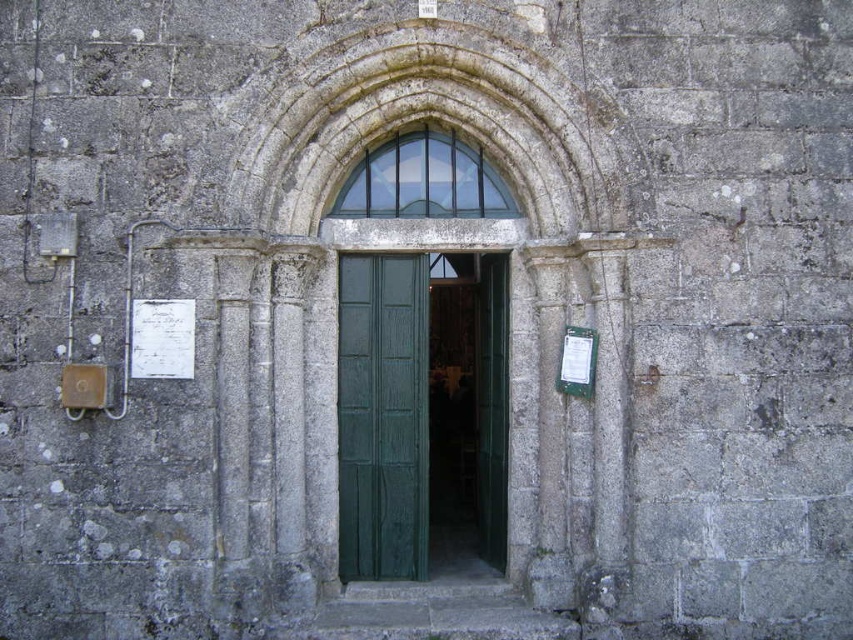
Question: Which is nearer to the green wooden door at center?

Choices:
 (A) clear glass window at center
 (B) white paper sign at upper left

Answer: (A)

Question: In this image, where is white paper sign at upper left located relative to white paper at right?

Choices:
 (A) left
 (B) right

Answer: (A)

Question: Is the position of green wooden door at center more distant than that of white paper sign at upper left?

Choices:
 (A) yes
 (B) no

Answer: (A)

Question: Which of the following is the farthest from the observer?

Choices:
 (A) (355, 369)
 (B) (134, 362)
 (C) (387, 161)

Answer: (C)

Question: Considering the relative positions of green wooden door at center and white paper at right in the image provided, where is green wooden door at center located with respect to white paper at right?

Choices:
 (A) below
 (B) above

Answer: (A)

Question: Which point is farther to the camera?

Choices:
 (A) (340, 374)
 (B) (585, 346)
 (C) (186, 323)

Answer: (A)